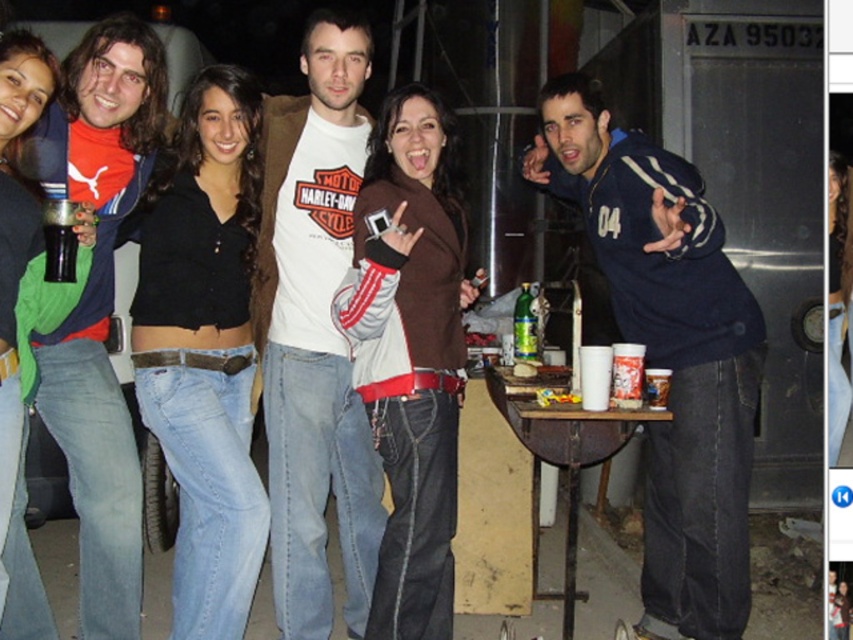
Can you confirm if black cotton top at center is smaller than matte blue jacket at left?

Yes, black cotton top at center is smaller than matte blue jacket at left.

Consider the image. Which is above, black cotton top at center or matte blue jacket at left?

Positioned higher is matte blue jacket at left.

Is point (187, 336) positioned before point (38, 584)?

Yes, point (187, 336) is closer to viewer.

The width and height of the screenshot is (853, 640). I want to click on black cotton top at center, so click(x=206, y=349).

Locate an element on the screen. Image resolution: width=853 pixels, height=640 pixels. black cotton top at center is located at coordinates (206, 349).

Does black cotton top at center appear on the left side of green glass bottle at center?

Indeed, black cotton top at center is positioned on the left side of green glass bottle at center.

In the scene shown: Measure the distance between black cotton top at center and camera.

black cotton top at center is 2.96 meters away from camera.

Where is `black cotton top at center`? This screenshot has height=640, width=853. black cotton top at center is located at coordinates (206, 349).

Who is taller, white cotton t-shirt at center or matte blue jacket at left?

white cotton t-shirt at center

Is point (306, 477) closer to camera compared to point (44, 120)?

No, (306, 477) is further to viewer.

The height and width of the screenshot is (640, 853). In order to click on white cotton t-shirt at center in this screenshot , I will do (x=315, y=333).

At what (x,y) coordinates should I click in order to perform the action: click on white cotton t-shirt at center. Please return your answer as a coordinate pair (x, y). The width and height of the screenshot is (853, 640). Looking at the image, I should click on (315, 333).